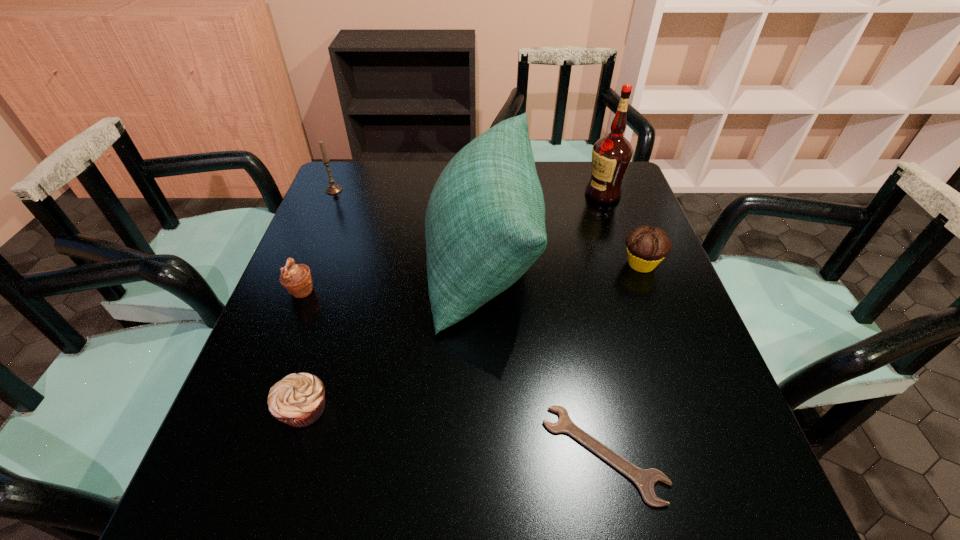
Identify the location of the fourth closest object to the alcohol. The height and width of the screenshot is (540, 960). (333, 188).

Identify the location of the third closest object to the wrench. The height and width of the screenshot is (540, 960). (298, 400).

Identify the location of the second closest muffin to the candle. The image size is (960, 540). (298, 400).

The image size is (960, 540). Identify the location of muffin that stands as the closest to the farthest muffin. (298, 400).

At what (x,y) coordinates should I click in order to perform the action: click on free spot that satisfies the following two spatial constraints: 1. on the label of the alcohol; 2. on the front side of the leftmost muffin. Please return your answer as a coordinate pair (x, y). Looking at the image, I should click on (636, 291).

Where is `free space that satisfies the following two spatial constraints: 1. on the back side of the farthest muffin; 2. on the front-facing side of the sixth shortest object`? The image size is (960, 540). free space that satisfies the following two spatial constraints: 1. on the back side of the farthest muffin; 2. on the front-facing side of the sixth shortest object is located at coordinates coord(639,259).